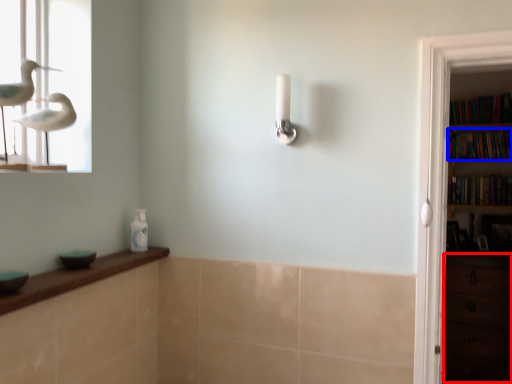
Question: Which of the following is the closest to the observer, drawer (highlighted by a red box) or book (highlighted by a blue box)?

Choices:
 (A) drawer
 (B) book

Answer: (A)